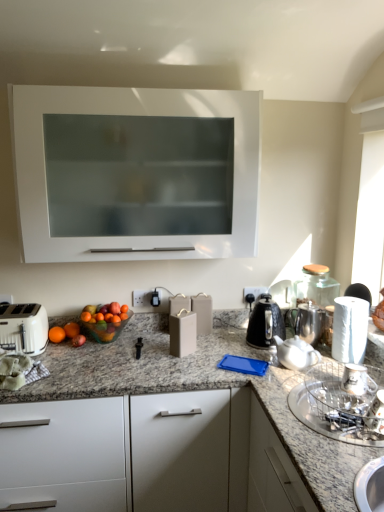
Locate an element on the screen. This screenshot has width=384, height=512. vacant space positioned to the left of metallic silver cup at lower right, acting as the 1th appliance starting from the right is located at coordinates (314, 391).